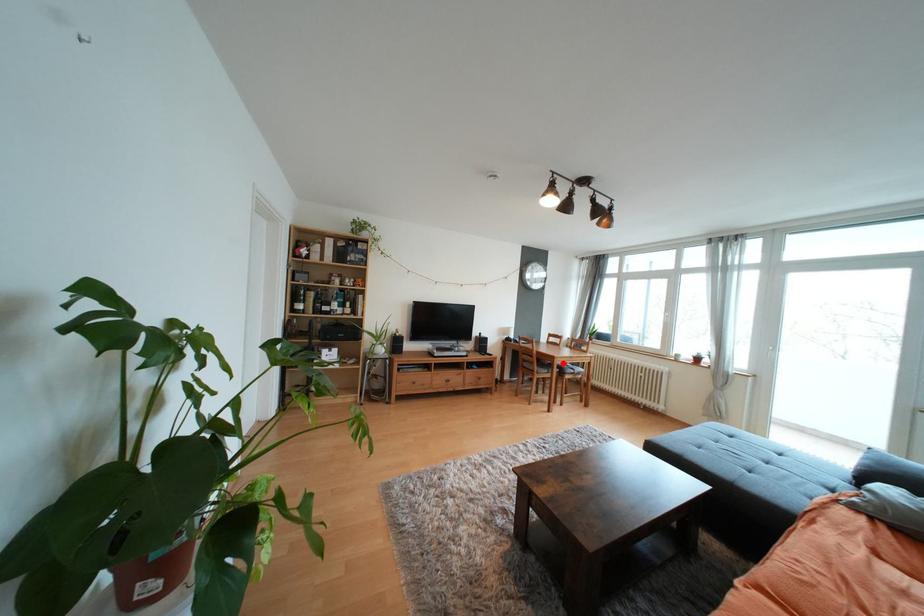
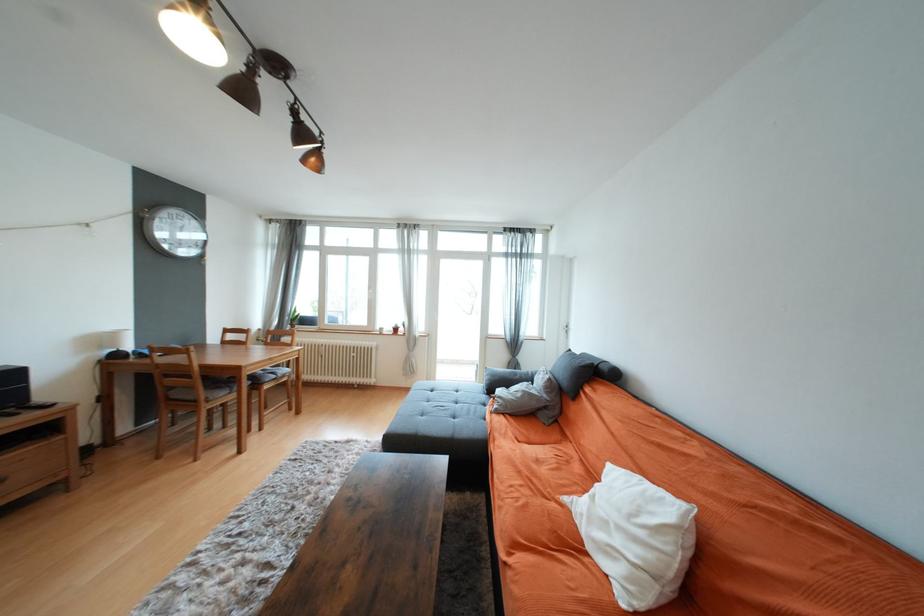
Locate, in the second image, the point that corresponds to the highlighted location in the first image.

(253, 374)